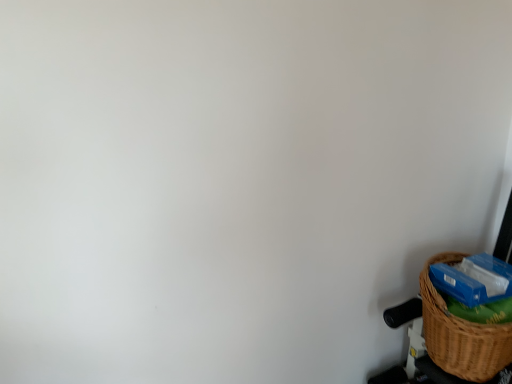
You are a GUI agent. You are given a task and a screenshot of the screen. Output one action in this format:
    pyautogui.click(x=<x>, y=<y>)
    Task: Click on the woven brown picnic basket at lower right
    
    Given the screenshot: What is the action you would take?
    pyautogui.click(x=461, y=333)

This screenshot has height=384, width=512. What do you see at coordinates (461, 333) in the screenshot?
I see `woven brown picnic basket at lower right` at bounding box center [461, 333].

The height and width of the screenshot is (384, 512). Identify the location of woven brown picnic basket at lower right. (461, 333).